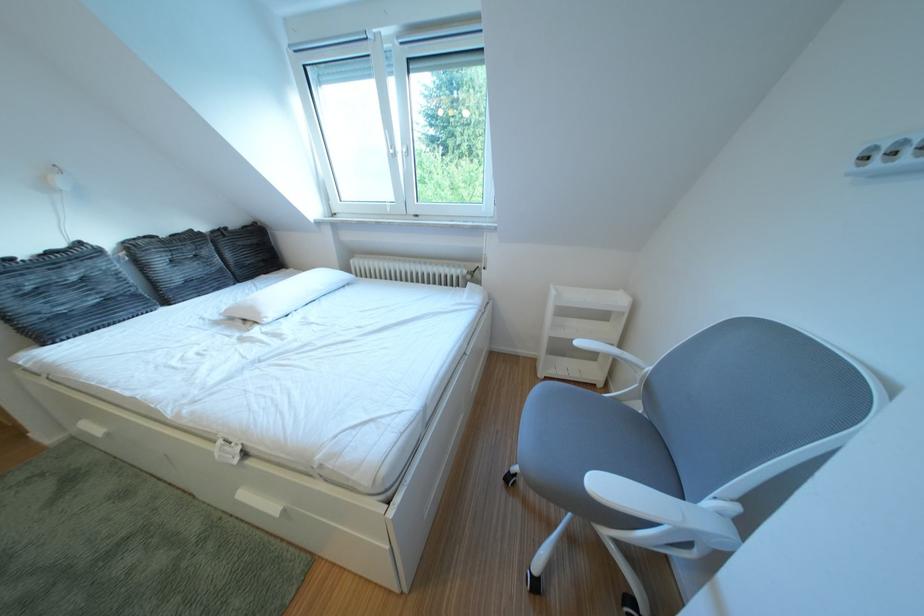
Where would you sit the chair sitting surface? Please return your answer as a coordinate pair (x, y).

(606, 435)